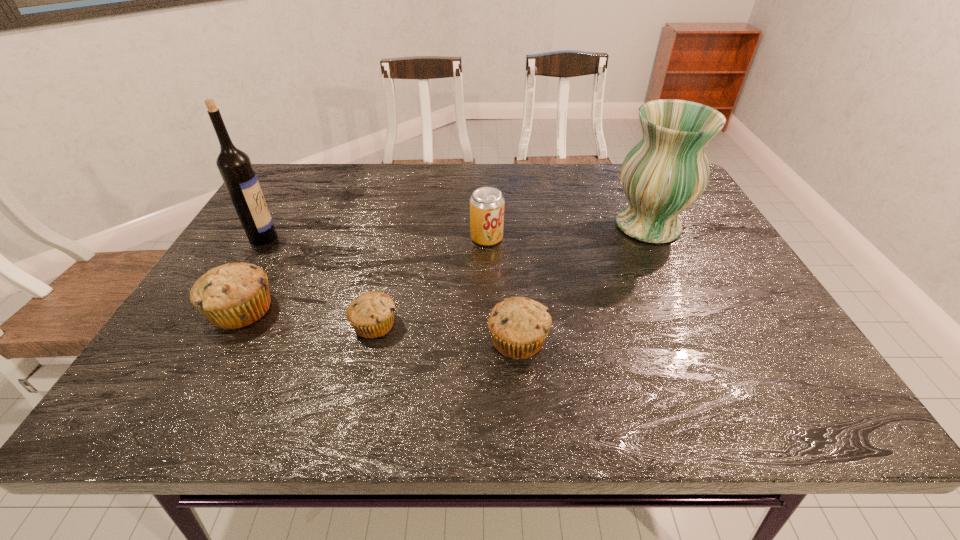
The width and height of the screenshot is (960, 540). Identify the location of unoccupied area between the pop (soda) and the wine bottle. (375, 238).

Find the location of a particular element. This screenshot has height=540, width=960. vacant space that's between the fourth object from right to left and the rightmost object is located at coordinates (512, 275).

At what (x,y) coordinates should I click in order to perform the action: click on vacant space that's between the fifth shortest object and the rightmost muffin. Please return your answer as a coordinate pair (x, y). Image resolution: width=960 pixels, height=540 pixels. Looking at the image, I should click on (583, 284).

What are the coordinates of `object that is the fourth closest to the third object from left to right` in the screenshot? It's located at (234, 165).

Identify which object is the fifth nearest to the shortest muffin. Please provide its 2D coordinates. Your answer should be formatted as a tuple, i.e. [(x, y)], where the tuple contains the x and y coordinates of a point satisfying the conditions above.

[(667, 171)]

I want to click on the closest muffin to the second tallest muffin, so click(x=371, y=314).

Find the location of a particular element. muffin that is the third nearest to the wine bottle is located at coordinates (519, 326).

Locate an element on the screen. free space that satisfies the following two spatial constraints: 1. on the back side of the shortest object; 2. on the label of the wine bottle is located at coordinates (396, 238).

Find the location of a particular element. The image size is (960, 540). free spot that satisfies the following two spatial constraints: 1. on the label of the shortest muffin; 2. on the left side of the wine bottle is located at coordinates (210, 325).

Where is `vacant space that satisfies the following two spatial constraints: 1. on the front side of the leftmost muffin; 2. on the right side of the second shortest object`? The image size is (960, 540). vacant space that satisfies the following two spatial constraints: 1. on the front side of the leftmost muffin; 2. on the right side of the second shortest object is located at coordinates (225, 341).